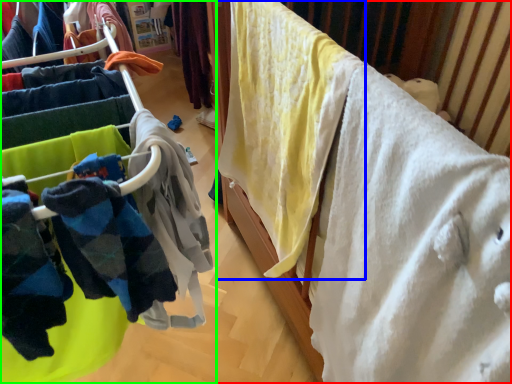
Question: Which object is positioned closest to furniture (highlighted by a red box)? Select from clothing (highlighted by a blue box) and closet (highlighted by a green box).

Choices:
 (A) clothing
 (B) closet

Answer: (A)